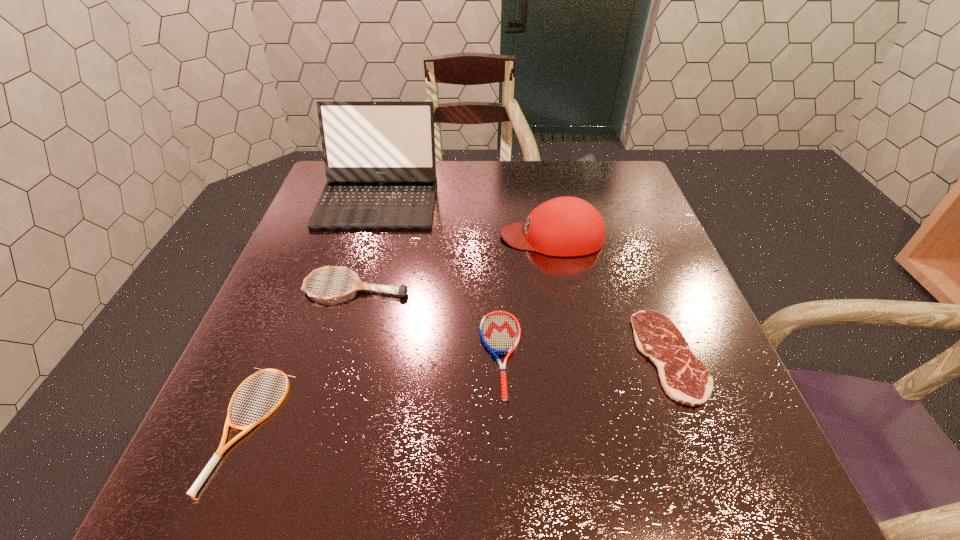
This screenshot has width=960, height=540. Find the location of `free region located on the back of the fourth nearest object`. free region located on the back of the fourth nearest object is located at coordinates (383, 195).

Locate an element on the screen. Image resolution: width=960 pixels, height=540 pixels. vacant space located 0.150m on the front of the steak is located at coordinates (723, 500).

Where is `vacant region located 0.090m on the back of the rightmost tennis racket`? This screenshot has height=540, width=960. vacant region located 0.090m on the back of the rightmost tennis racket is located at coordinates (498, 284).

Where is `object situated at the far edge`? Image resolution: width=960 pixels, height=540 pixels. object situated at the far edge is located at coordinates (379, 156).

This screenshot has width=960, height=540. Find the location of `object at the near edge`. object at the near edge is located at coordinates (193, 490).

Identify the location of laptop that is at the left edge. Image resolution: width=960 pixels, height=540 pixels. (379, 156).

The image size is (960, 540). Find the location of `baseball cap present at the right edge`. baseball cap present at the right edge is located at coordinates (566, 226).

Where is `steak at the right edge`? steak at the right edge is located at coordinates (684, 378).

I want to click on object that is positioned at the far left corner, so click(379, 156).

Find the location of a particular element. object at the near left corner is located at coordinates (193, 490).